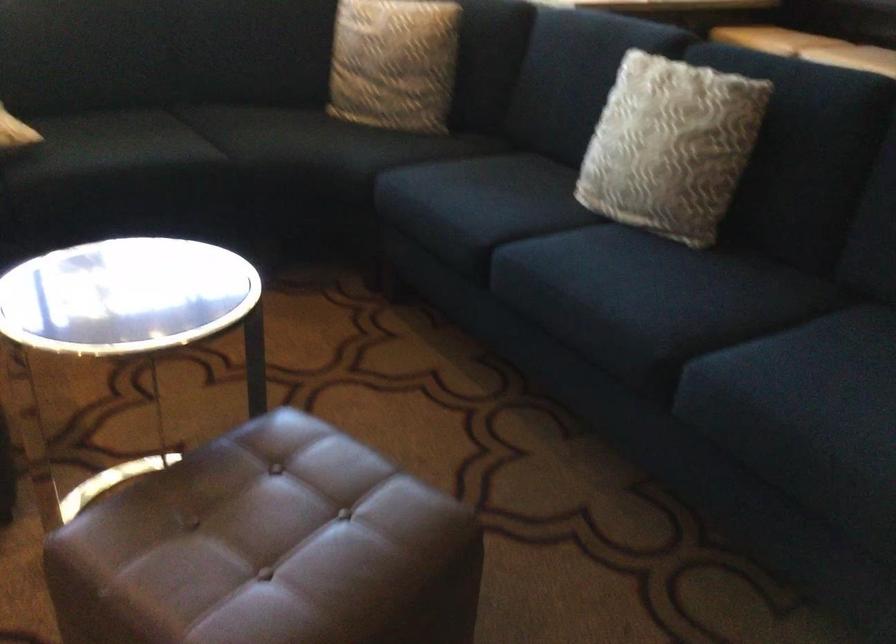
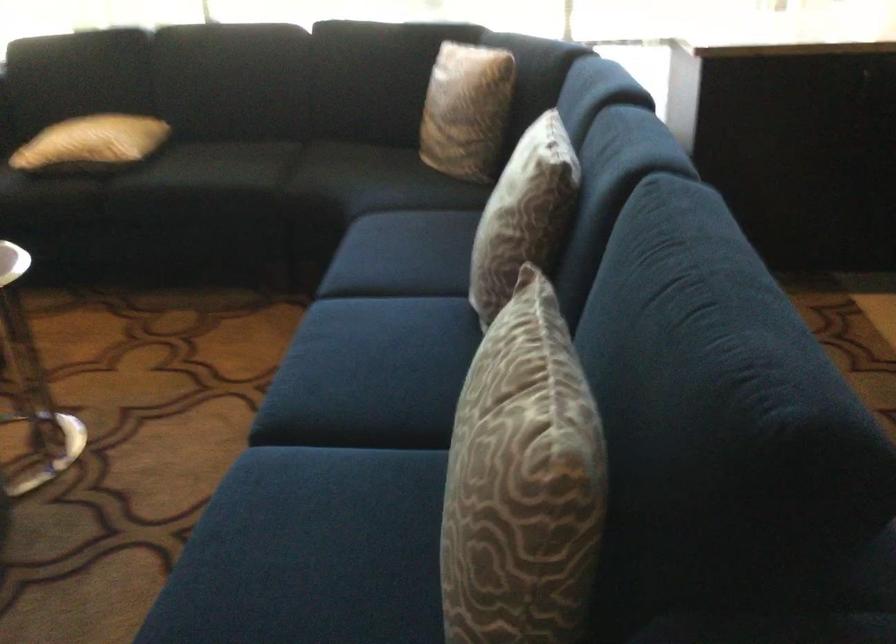
Locate, in the second image, the point that corresponds to point (754, 346) in the first image.

(341, 458)